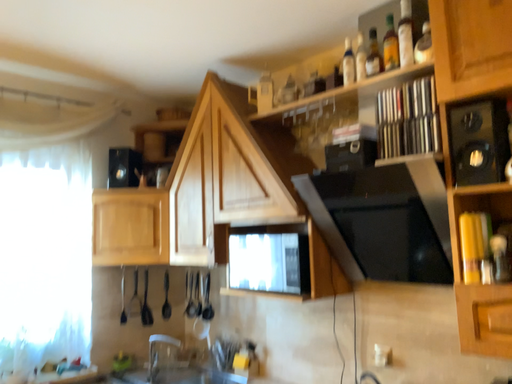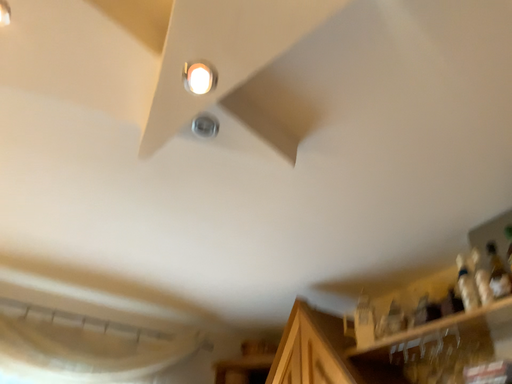
Question: How did the camera likely rotate when shooting the video?

Choices:
 (A) rotated upward
 (B) rotated downward

Answer: (A)